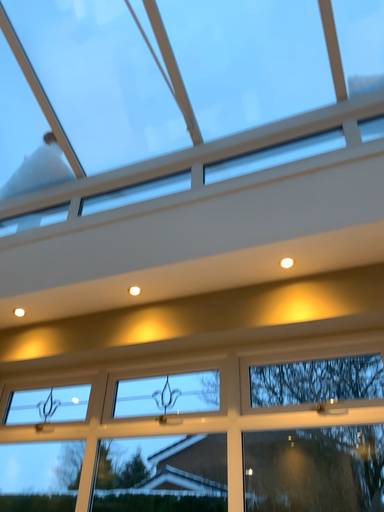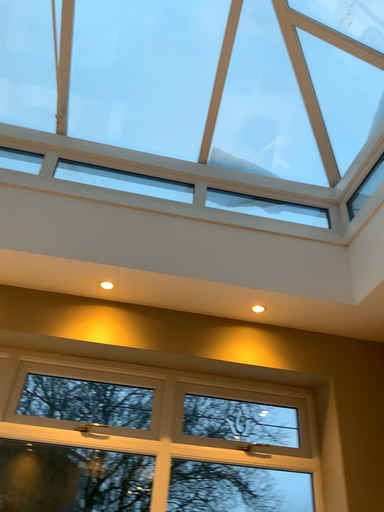
Question: Which way did the camera rotate in the video?

Choices:
 (A) rotated right
 (B) rotated left

Answer: (A)